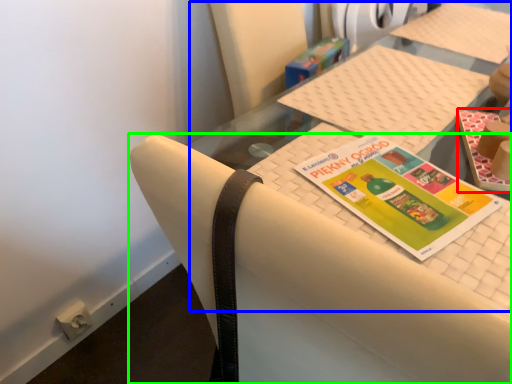
Question: Which is nearer to the book (highlighted by a red box)? tablecloth (highlighted by a blue box) or chair (highlighted by a green box).

Choices:
 (A) tablecloth
 (B) chair

Answer: (A)